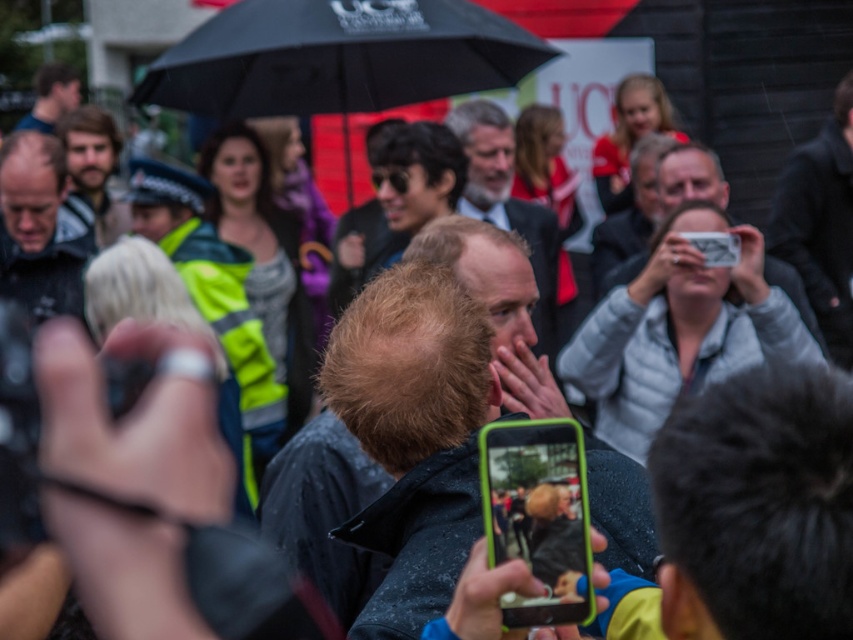
Who is positioned more to the left, black matte umbrella at center or smooth gray suit at center?

From the viewer's perspective, black matte umbrella at center appears more on the left side.

Describe the element at coordinates (338, 58) in the screenshot. This screenshot has width=853, height=640. I see `black matte umbrella at center` at that location.

Where is `black matte umbrella at center`? black matte umbrella at center is located at coordinates (x=338, y=58).

Does point (386, 259) lie behind point (795, 300)?

Yes, it is behind point (795, 300).

Which of these two, sunglasses at center or gray fabric jacket at upper center, stands shorter?

gray fabric jacket at upper center

Where is `sunglasses at center`? sunglasses at center is located at coordinates (397, 202).

What are the coordinates of `sunglasses at center` in the screenshot? It's located at (397, 202).

In the scene shown: Is matte black phone at center closer to the viewer compared to black matte umbrella at center?

That is True.

This screenshot has width=853, height=640. I want to click on matte black phone at center, so click(x=415, y=435).